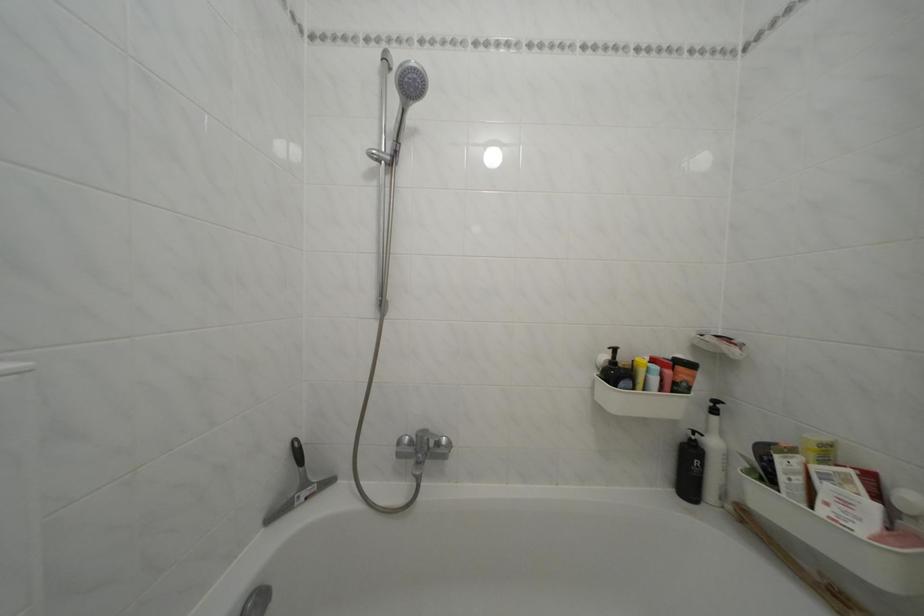
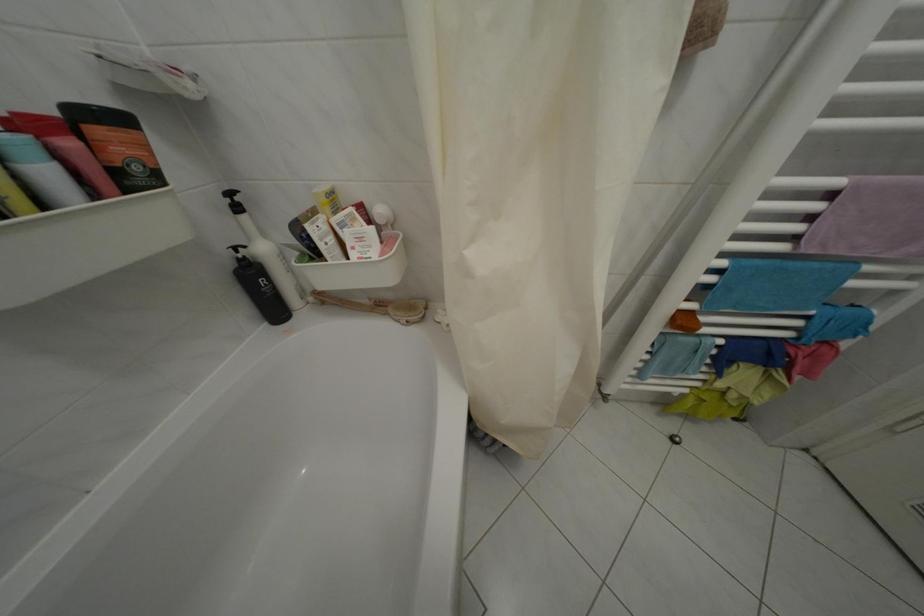
Find the pixel in the second image that matches pixel 711 442 in the first image.

(253, 254)